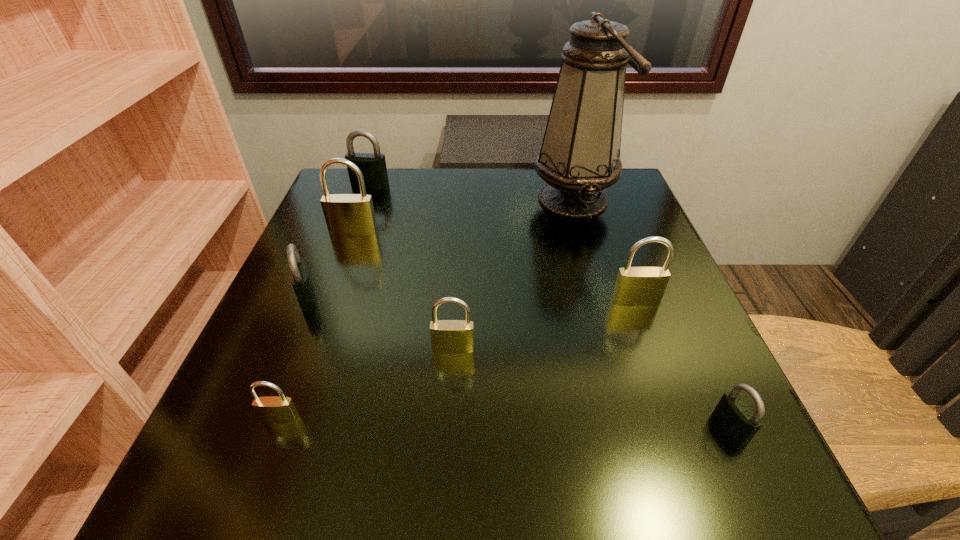
Select which black padlock appears as the closest to the tallest object. Please provide its 2D coordinates. Your answer should be formatted as a tuple, i.e. [(x, y)], where the tuple contains the x and y coordinates of a point satisfying the conditions above.

[(373, 167)]

Select which black padlock is the closest to the rightmost object. Please provide its 2D coordinates. Your answer should be formatted as a tuple, i.e. [(x, y)], where the tuple contains the x and y coordinates of a point satisfying the conditions above.

[(300, 279)]

This screenshot has height=540, width=960. Find the location of `vacant position in the image that satisfies the following two spatial constraints: 1. on the front-facing side of the sixth nearest padlock; 2. on the left side of the rightmost black padlock`. vacant position in the image that satisfies the following two spatial constraints: 1. on the front-facing side of the sixth nearest padlock; 2. on the left side of the rightmost black padlock is located at coordinates pyautogui.click(x=283, y=427).